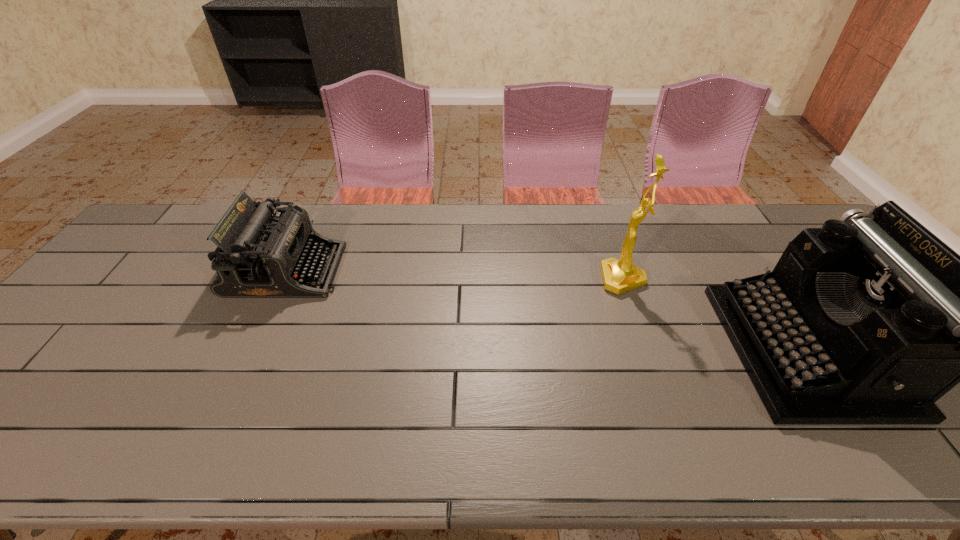
Identify the location of object that is the closest one to the award. The width and height of the screenshot is (960, 540). (869, 320).